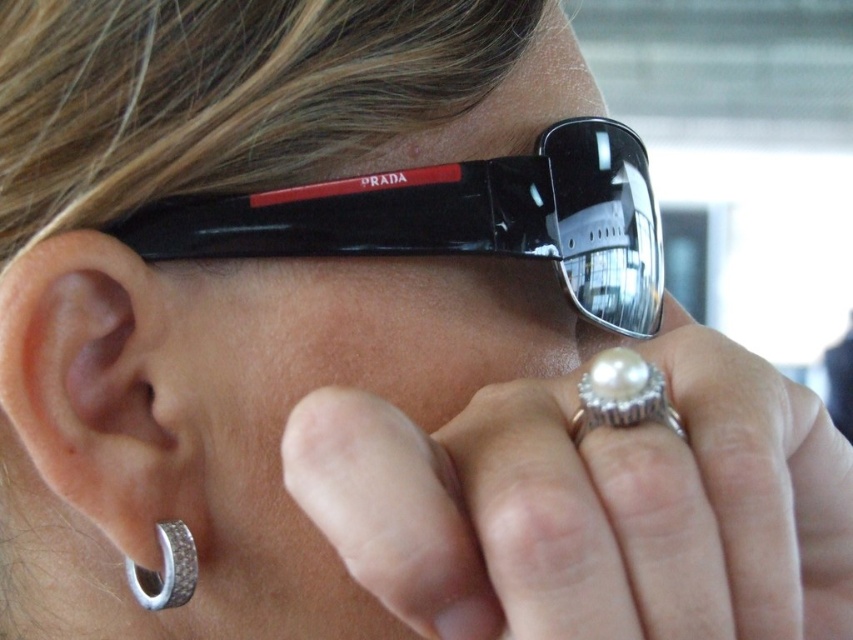
Who is shorter, black plastic sunglasses at upper center or silver/diamond hoop earring at lower left?

black plastic sunglasses at upper center is shorter.

What do you see at coordinates (456, 220) in the screenshot? The width and height of the screenshot is (853, 640). I see `black plastic sunglasses at upper center` at bounding box center [456, 220].

The image size is (853, 640). What are the coordinates of `black plastic sunglasses at upper center` in the screenshot? It's located at (456, 220).

At what (x,y) coordinates should I click in order to perform the action: click on black plastic sunglasses at upper center. Please return your answer as a coordinate pair (x, y). Looking at the image, I should click on (456, 220).

Does silver/diamond hoop earring at lower left appear over pearlsmoothring at right?

Actually, silver/diamond hoop earring at lower left is below pearlsmoothring at right.

Can you confirm if silver/diamond hoop earring at lower left is thinner than pearlsmoothring at right?

No.

This screenshot has height=640, width=853. What do you see at coordinates (102, 390) in the screenshot? I see `silver/diamond hoop earring at lower left` at bounding box center [102, 390].

Locate an element on the screen. The height and width of the screenshot is (640, 853). silver/diamond hoop earring at lower left is located at coordinates (102, 390).

Can you confirm if black plastic sunglasses at upper center is taller than silver textured ring at ear?

Yes.

Between point (309, 248) and point (136, 596), which one is positioned behind?

Positioned behind is point (136, 596).

Who is more forward, (277, 230) or (190, 536)?

Positioned in front is point (190, 536).

The image size is (853, 640). Find the location of `black plastic sunglasses at upper center`. black plastic sunglasses at upper center is located at coordinates (456, 220).